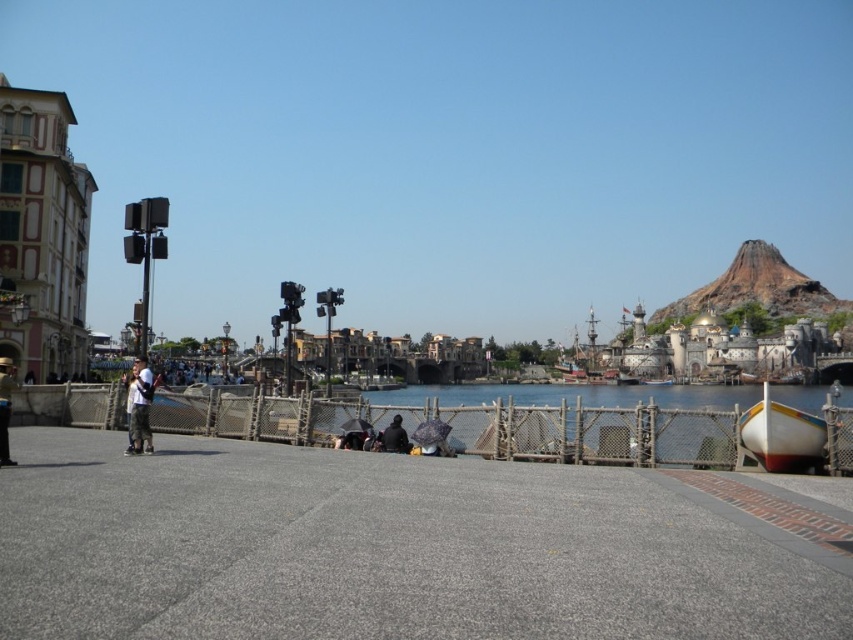
Question: Among these points, which one is nearest to the camera?

Choices:
 (A) (737, 595)
 (B) (389, 424)

Answer: (A)

Question: Which point is farther from the camera taking this photo?

Choices:
 (A) (399, 417)
 (B) (90, 532)
 (C) (793, 406)
 (D) (596, 440)

Answer: (C)

Question: Is white plastic boat at lower right bigger than white glossy boat at right?

Choices:
 (A) yes
 (B) no

Answer: (A)

Question: Which object is positioned closest to the matte black jacket at lower left?

Choices:
 (A) white plastic boat at lower right
 (B) dark gray fabric umbrella at center
 (C) light blue jeans at center

Answer: (C)

Question: Is white plastic boat at lower right to the right of white glossy boat at right from the viewer's perspective?

Choices:
 (A) yes
 (B) no

Answer: (B)

Question: Can you confirm if gray concrete plaza at center is positioned to the left of white plastic boat at lower right?

Choices:
 (A) no
 (B) yes

Answer: (B)